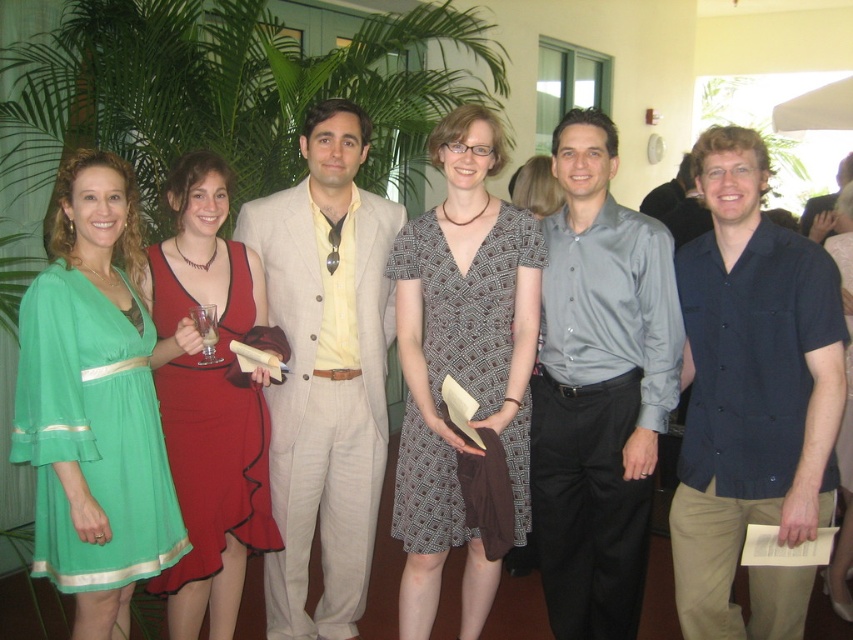
Question: Which of the following is the closest to the observer?

Choices:
 (A) shiny gray shirt at center
 (B) matte black dress at center
 (C) matte red dress at center
 (D) light beige suit at center

Answer: (A)

Question: Does shiny gray shirt at center have a smaller size compared to matte red dress at center?

Choices:
 (A) yes
 (B) no

Answer: (B)

Question: Which point appears closest to the camera in this image?

Choices:
 (A) (804, 403)
 (B) (845, 369)
 (C) (548, 548)

Answer: (A)

Question: Is dark blue button-up shirt at center thinner than patterned fabric dress at center?

Choices:
 (A) yes
 (B) no

Answer: (A)

Question: Which point is farther to the camera?

Choices:
 (A) (827, 474)
 (B) (595, 237)
 (C) (305, 330)
 (D) (460, 285)

Answer: (C)

Question: Does dark blue button-up shirt at center appear on the left side of matte red dress at center?

Choices:
 (A) no
 (B) yes

Answer: (A)